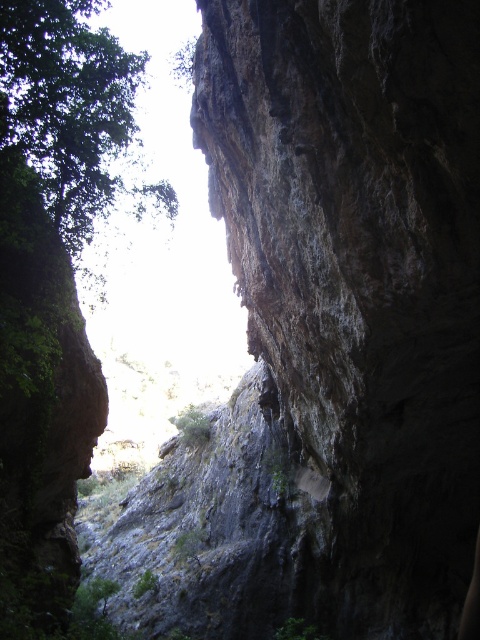
Does dark brown rocky cliff at upper right appear on the left side of green leafy tree at upper left?

In fact, dark brown rocky cliff at upper right is to the right of green leafy tree at upper left.

Is dark brown rocky cliff at upper right positioned behind green leafy tree at upper left?

No, it is not.

What do you see at coordinates (360, 275) in the screenshot? Image resolution: width=480 pixels, height=640 pixels. I see `dark brown rocky cliff at upper right` at bounding box center [360, 275].

You are a GUI agent. You are given a task and a screenshot of the screen. Output one action in this format:
    pyautogui.click(x=<x>, y=<y>)
    Task: Click on the dark brown rocky cliff at upper right
    
    Given the screenshot: What is the action you would take?
    pyautogui.click(x=360, y=275)